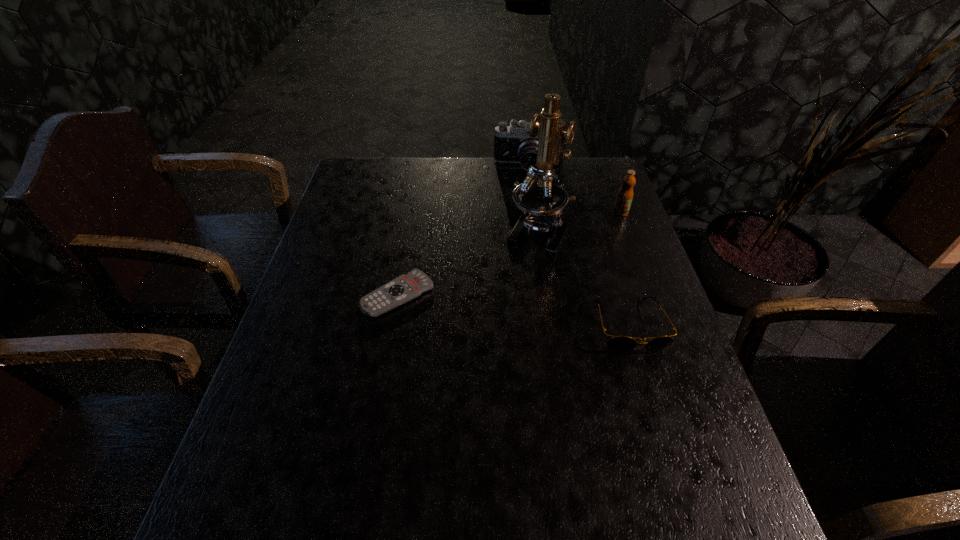
Where is `vacant position located 0.330m on the front-facing side of the farthest object`? vacant position located 0.330m on the front-facing side of the farthest object is located at coordinates (525, 241).

You are a GUI agent. You are given a task and a screenshot of the screen. Output one action in this format:
    pyautogui.click(x=<x>, y=<y>)
    Task: Click on the vacant region located 0.280m at the eyepiece of the microscope
    The height and width of the screenshot is (540, 960).
    Given the screenshot: What is the action you would take?
    pyautogui.click(x=487, y=328)

Find the location of a particular element. The width and height of the screenshot is (960, 540). free space located 0.390m at the eyepiece of the microscope is located at coordinates (467, 364).

Where is `vacant position located at the eyepiece of the microscope`? The height and width of the screenshot is (540, 960). vacant position located at the eyepiece of the microscope is located at coordinates tap(474, 350).

Where is `free location located 0.120m on the front label of the orange juice`? free location located 0.120m on the front label of the orange juice is located at coordinates (597, 234).

Where is `vacant region located on the front label of the orange juice`? This screenshot has height=540, width=960. vacant region located on the front label of the orange juice is located at coordinates (587, 245).

This screenshot has width=960, height=540. I want to click on free space located on the front label of the orange juice, so click(571, 259).

You are a GUI agent. You are given a task and a screenshot of the screen. Output one action in this format:
    pyautogui.click(x=<x>, y=<y>)
    Task: Click on the object that is at the far edge
    Image resolution: width=960 pixels, height=540 pixels.
    Given the screenshot: What is the action you would take?
    pyautogui.click(x=512, y=144)

Locate an element on the screen. object that is at the left edge is located at coordinates (406, 287).

Locate an element on the screen. This screenshot has width=960, height=540. sunglasses that is at the right edge is located at coordinates (617, 343).